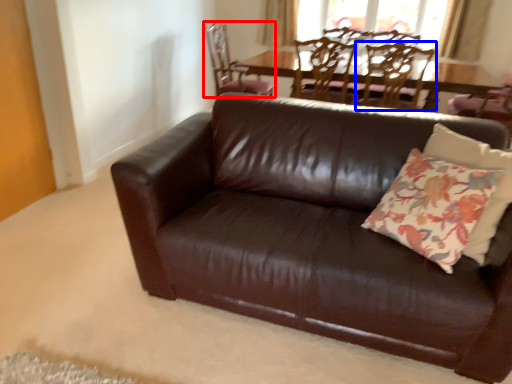
Question: Among these objects, which one is nearest to the camera, chair (highlighted by a red box) or chair (highlighted by a blue box)?

Choices:
 (A) chair
 (B) chair

Answer: (B)